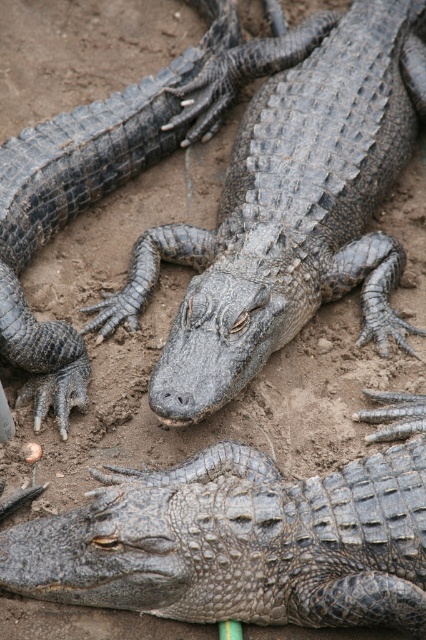
Question: Which of the following is the farthest from the observer?

Choices:
 (A) gray scaly crocodile at center
 (B) gray textured crocodile at center

Answer: (A)

Question: Which object is farther from the camera taking this photo?

Choices:
 (A) gray scaly crocodile at center
 (B) gray textured crocodile at center

Answer: (A)

Question: Does gray scaly crocodile at center appear under gray textured crocodile at center?

Choices:
 (A) yes
 (B) no

Answer: (B)

Question: Is gray scaly crocodile at center to the left of gray textured crocodile at center from the viewer's perspective?

Choices:
 (A) yes
 (B) no

Answer: (B)

Question: In this image, where is gray scaly crocodile at center located relative to gray textured crocodile at center?

Choices:
 (A) left
 (B) right

Answer: (B)